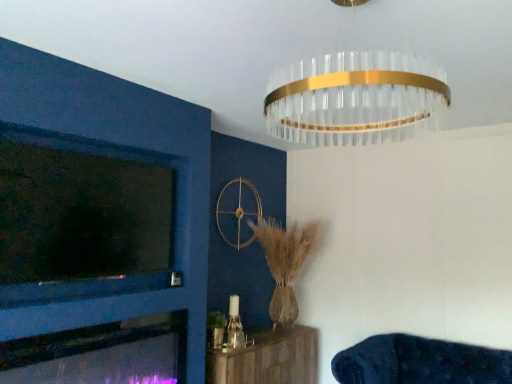
Describe the element at coordinates (420, 362) in the screenshot. I see `dark blue plush couch at lower right, marked as the 2th furniture in a left-to-right arrangement` at that location.

In order to face wooden shelf at lower center, placed as the 2th furniture when sorted from right to left, should I rotate leftwards or rightwards?

You should look right and rotate roughly 0.031 degrees.

The image size is (512, 384). What are the coordinates of `clear glass chandelier at upper center` in the screenshot? It's located at (355, 99).

Is wooden shelf at lower center, placed as the 2th furniture when sorted from right to left, directly adjacent to dark blue plush couch at lower right, marked as the 2th furniture in a left-to-right arrangement?

No.

Find the location of a particular element. This screenshot has height=384, width=512. furniture located above the wooden shelf at lower center, which ranks as the 1th furniture in left-to-right order (from a real-world perspective) is located at coordinates (420, 362).

Considering the relative sizes of wooden shelf at lower center, which ranks as the 1th furniture in left-to-right order, and dark blue plush couch at lower right, which ranks as the 1th furniture in right-to-left order, in the image provided, is wooden shelf at lower center, which ranks as the 1th furniture in left-to-right order, smaller than dark blue plush couch at lower right, which ranks as the 1th furniture in right-to-left order,?

Yes, wooden shelf at lower center, which ranks as the 1th furniture in left-to-right order, is smaller than dark blue plush couch at lower right, which ranks as the 1th furniture in right-to-left order.

Can you confirm if matte glass fireplace at lower left is wider than wooden shelf at lower center, placed as the 2th furniture when sorted from right to left?

No.

Consider the image. Is matte glass fireplace at lower left next to wooden shelf at lower center, placed as the 2th furniture when sorted from right to left, and touching it?

No, matte glass fireplace at lower left is not next to wooden shelf at lower center, placed as the 2th furniture when sorted from right to left.

Who is bigger, matte glass fireplace at lower left or wooden shelf at lower center, which ranks as the 1th furniture in left-to-right order?

wooden shelf at lower center, which ranks as the 1th furniture in left-to-right order, is bigger.

Considering the relative positions of dark blue plush couch at lower right, marked as the 2th furniture in a left-to-right arrangement, and matte glass fireplace at lower left in the image provided, is dark blue plush couch at lower right, marked as the 2th furniture in a left-to-right arrangement, to the left or to the right of matte glass fireplace at lower left?

dark blue plush couch at lower right, marked as the 2th furniture in a left-to-right arrangement, is positioned on matte glass fireplace at lower left's right side.

Are dark blue plush couch at lower right, which ranks as the 1th furniture in right-to-left order, and matte glass fireplace at lower left beside each other?

No.

Consider the image. Is matte glass fireplace at lower left at the back of dark blue plush couch at lower right, which ranks as the 1th furniture in right-to-left order?

No, dark blue plush couch at lower right, which ranks as the 1th furniture in right-to-left order, is not facing the opposite direction of matte glass fireplace at lower left.

Is point (469, 353) closer to viewer compared to point (104, 329)?

No, (469, 353) is further to viewer.

Looking at this image, is dark blue plush couch at lower right, marked as the 2th furniture in a left-to-right arrangement, spatially inside clear glass chandelier at upper center, or outside of it?

dark blue plush couch at lower right, marked as the 2th furniture in a left-to-right arrangement, exists outside the volume of clear glass chandelier at upper center.

Considering the sizes of objects dark blue plush couch at lower right, which ranks as the 1th furniture in right-to-left order, and clear glass chandelier at upper center in the image provided, who is shorter, dark blue plush couch at lower right, which ranks as the 1th furniture in right-to-left order, or clear glass chandelier at upper center?

dark blue plush couch at lower right, which ranks as the 1th furniture in right-to-left order, is shorter.

Where is `the 1st furniture behind the clear glass chandelier at upper center, starting your count from the anchor`? This screenshot has height=384, width=512. the 1st furniture behind the clear glass chandelier at upper center, starting your count from the anchor is located at coordinates (420, 362).

From the image's perspective, is wooden shelf at lower center, placed as the 2th furniture when sorted from right to left, below matte glass fireplace at lower left?

Indeed, from the image's perspective, wooden shelf at lower center, placed as the 2th furniture when sorted from right to left, is shown beneath matte glass fireplace at lower left.

Is point (254, 362) in front of point (162, 328)?

No, it is behind (162, 328).

Is matte glass fireplace at lower left inside wooden shelf at lower center, placed as the 2th furniture when sorted from right to left?

No, matte glass fireplace at lower left is located outside of wooden shelf at lower center, placed as the 2th furniture when sorted from right to left.

Does wooden shelf at lower center, placed as the 2th furniture when sorted from right to left, come in front of matte glass fireplace at lower left?

No, wooden shelf at lower center, placed as the 2th furniture when sorted from right to left, is further to the viewer.

From the image's perspective, is matte glass fireplace at lower left under dark blue plush couch at lower right, marked as the 2th furniture in a left-to-right arrangement?

Incorrect, from the image's perspective, matte glass fireplace at lower left is higher than dark blue plush couch at lower right, marked as the 2th furniture in a left-to-right arrangement.

From a real-world perspective, which is physically below, matte glass fireplace at lower left or dark blue plush couch at lower right, marked as the 2th furniture in a left-to-right arrangement?

From a 3D spatial view, dark blue plush couch at lower right, marked as the 2th furniture in a left-to-right arrangement, is below.

Is matte glass fireplace at lower left with dark blue plush couch at lower right, marked as the 2th furniture in a left-to-right arrangement?

matte glass fireplace at lower left and dark blue plush couch at lower right, marked as the 2th furniture in a left-to-right arrangement, are clearly separated.

In terms of width, does matte glass fireplace at lower left look wider or thinner when compared to dark blue plush couch at lower right, marked as the 2th furniture in a left-to-right arrangement?

Clearly, matte glass fireplace at lower left has less width compared to dark blue plush couch at lower right, marked as the 2th furniture in a left-to-right arrangement.

Does clear glass chandelier at upper center have a greater height compared to dark blue plush couch at lower right, marked as the 2th furniture in a left-to-right arrangement?

Yes.

How many degrees apart are the facing directions of clear glass chandelier at upper center and dark blue plush couch at lower right, which ranks as the 1th furniture in right-to-left order?

94.9 degrees.

From a real-world perspective, who is located lower, clear glass chandelier at upper center or dark blue plush couch at lower right, which ranks as the 1th furniture in right-to-left order?

In real-world perspective, dark blue plush couch at lower right, which ranks as the 1th furniture in right-to-left order, is lower.

Considering the relative sizes of clear glass chandelier at upper center and dark blue plush couch at lower right, which ranks as the 1th furniture in right-to-left order, in the image provided, is clear glass chandelier at upper center smaller than dark blue plush couch at lower right, which ranks as the 1th furniture in right-to-left order,?

Yes.

This screenshot has width=512, height=384. In order to click on furniture located below the dark blue plush couch at lower right, marked as the 2th furniture in a left-to-right arrangement (from the image's perspective) in this screenshot , I will do `click(267, 359)`.

Find the location of a particular element. the 2nd furniture located beneath the matte glass fireplace at lower left (from a real-world perspective) is located at coordinates (267, 359).

Based on their spatial positions, is dark blue plush couch at lower right, marked as the 2th furniture in a left-to-right arrangement, or clear glass chandelier at upper center further from wooden shelf at lower center, which ranks as the 1th furniture in left-to-right order?

Among the two, clear glass chandelier at upper center is located further to wooden shelf at lower center, which ranks as the 1th furniture in left-to-right order.

From the image, which object appears to be farther from wooden shelf at lower center, which ranks as the 1th furniture in left-to-right order, matte glass fireplace at lower left or dark blue plush couch at lower right, which ranks as the 1th furniture in right-to-left order?

The object further to wooden shelf at lower center, which ranks as the 1th furniture in left-to-right order, is matte glass fireplace at lower left.

Looking at the image, which one is located further to wooden shelf at lower center, placed as the 2th furniture when sorted from right to left, matte glass fireplace at lower left or clear glass chandelier at upper center?

clear glass chandelier at upper center is further to wooden shelf at lower center, placed as the 2th furniture when sorted from right to left.

Considering their positions, is wooden shelf at lower center, placed as the 2th furniture when sorted from right to left, positioned closer to dark blue plush couch at lower right, marked as the 2th furniture in a left-to-right arrangement, than matte glass fireplace at lower left?

Based on the image, wooden shelf at lower center, placed as the 2th furniture when sorted from right to left, appears to be nearer to dark blue plush couch at lower right, marked as the 2th furniture in a left-to-right arrangement.

Looking at the image, which one is located further to matte glass fireplace at lower left, wooden shelf at lower center, placed as the 2th furniture when sorted from right to left, or clear glass chandelier at upper center?

clear glass chandelier at upper center.

Considering their positions, is matte glass fireplace at lower left positioned further to clear glass chandelier at upper center than wooden shelf at lower center, which ranks as the 1th furniture in left-to-right order?

The object further to clear glass chandelier at upper center is wooden shelf at lower center, which ranks as the 1th furniture in left-to-right order.

When comparing their distances from matte glass fireplace at lower left, does clear glass chandelier at upper center or dark blue plush couch at lower right, marked as the 2th furniture in a left-to-right arrangement, seem further?

clear glass chandelier at upper center is positioned further to the anchor matte glass fireplace at lower left.

Considering their positions, is wooden shelf at lower center, placed as the 2th furniture when sorted from right to left, positioned further to clear glass chandelier at upper center than dark blue plush couch at lower right, marked as the 2th furniture in a left-to-right arrangement?

Among the two, wooden shelf at lower center, placed as the 2th furniture when sorted from right to left, is located further to clear glass chandelier at upper center.

You are a GUI agent. You are given a task and a screenshot of the screen. Output one action in this format:
    pyautogui.click(x=<x>, y=<y>)
    Task: Click on the fireplace that lies between clear glass chandelier at upper center and wooden shelf at lower center, which ranks as the 1th furniture in left-to-right order, from top to bottom
    
    Given the screenshot: What is the action you would take?
    pyautogui.click(x=101, y=354)

Where is `furniture situated between matte glass fireplace at lower left and dark blue plush couch at lower right, which ranks as the 1th furniture in right-to-left order, from left to right`? furniture situated between matte glass fireplace at lower left and dark blue plush couch at lower right, which ranks as the 1th furniture in right-to-left order, from left to right is located at coordinates (267, 359).

Where is `lamp between matte glass fireplace at lower left and dark blue plush couch at lower right, marked as the 2th furniture in a left-to-right arrangement`? lamp between matte glass fireplace at lower left and dark blue plush couch at lower right, marked as the 2th furniture in a left-to-right arrangement is located at coordinates (355, 99).

Locate an element on the screen. The height and width of the screenshot is (384, 512). furniture between clear glass chandelier at upper center and wooden shelf at lower center, placed as the 2th furniture when sorted from right to left, vertically is located at coordinates (420, 362).